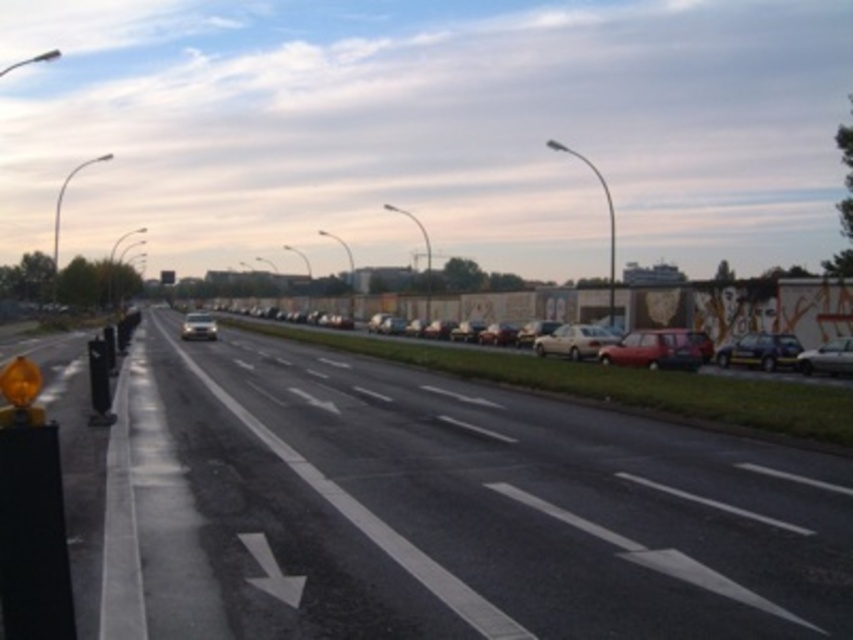
Question: Which object appears farthest from the camera in this image?

Choices:
 (A) shiny red car at right
 (B) black asphalt highway at center
 (C) metallic silver car at center

Answer: (A)

Question: Which of the following is the farthest from the observer?

Choices:
 (A) shiny silver sedan at right
 (B) black asphalt highway at center
 (C) metallic silver car at center

Answer: (A)

Question: Which of the following is the farthest from the observer?

Choices:
 (A) shiny red car at right
 (B) shiny silver sedan at right
 (C) black asphalt highway at center
 (D) satin silver sedan at center

Answer: (D)

Question: Is shiny red car at right positioned before matte silver sedan at center?

Choices:
 (A) no
 (B) yes

Answer: (B)

Question: Does metallic silver car at center lie in front of shiny silver sedan at right?

Choices:
 (A) yes
 (B) no

Answer: (A)

Question: In this image, where is shiny red car at right located relative to satin silver sedan at center?

Choices:
 (A) right
 (B) left

Answer: (A)